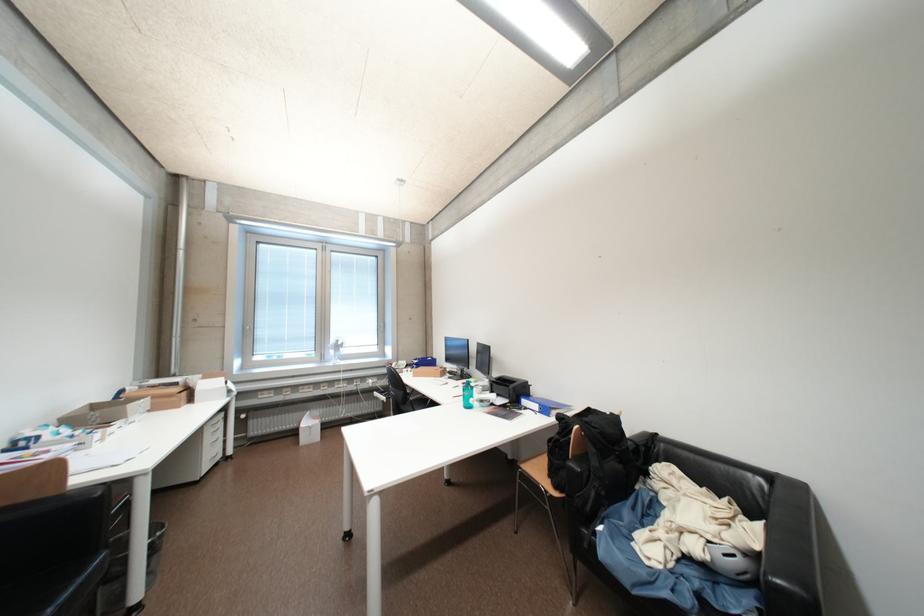
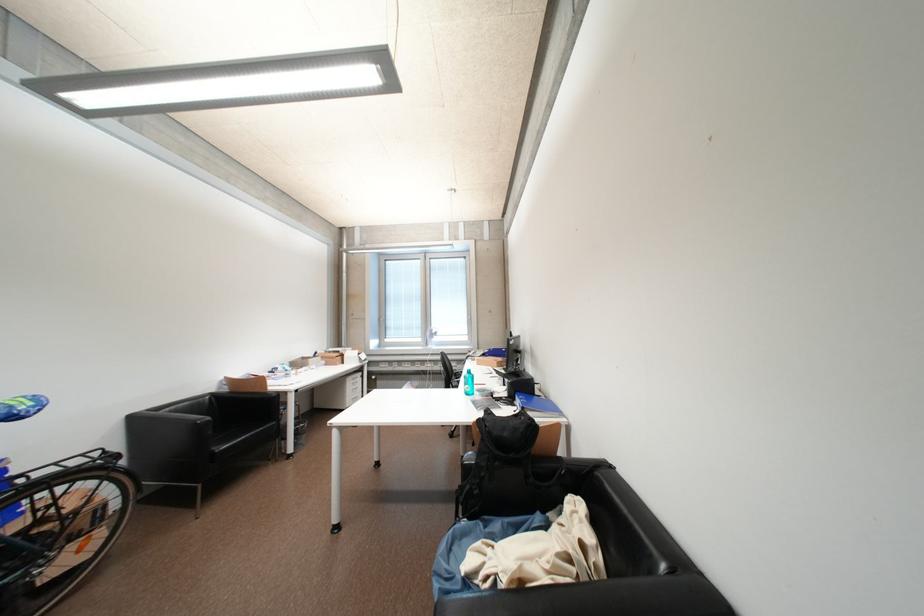
The point at (177, 398) is marked in the first image. Where is the corresponding point in the second image?

(341, 360)